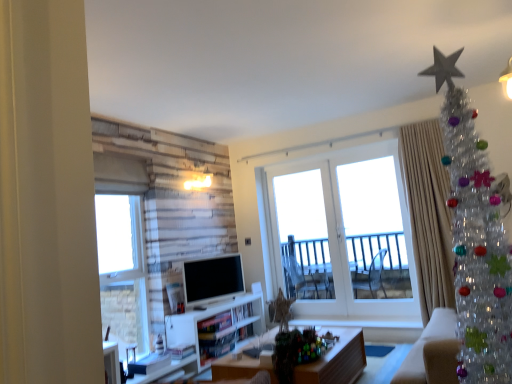
Find the location of a particular element. white glossy television at center is located at coordinates click(x=212, y=279).

Image resolution: width=512 pixels, height=384 pixels. What do you see at coordinates (122, 249) in the screenshot?
I see `clear glass window at left, which is counted as the 2th window, starting from the right` at bounding box center [122, 249].

Where is `clear glass window at left, the 1th window from the left`? clear glass window at left, the 1th window from the left is located at coordinates (122, 249).

Describe the element at coordinates (428, 213) in the screenshot. The width and height of the screenshot is (512, 384). I see `silky beige curtain at right` at that location.

In order to face wooden desk at center, should I rotate leftwards or rightwards?

Rotate your view right by about 5.305°.

This screenshot has height=384, width=512. What do you see at coordinates (475, 240) in the screenshot? I see `clear plastic christmas tree at upper right` at bounding box center [475, 240].

Image resolution: width=512 pixels, height=384 pixels. What are the coordinates of `white glass door at center, which is the 2th window in front-to-back order` in the screenshot? It's located at (333, 229).

Is point (301, 380) positioned after point (209, 259)?

No, (301, 380) is in front of (209, 259).

From a real-world perspective, who is located higher, wooden desk at center or white glossy television at center?

white glossy television at center.

Is wooden desk at center far from white glossy television at center?

Yes, wooden desk at center and white glossy television at center are quite far apart.

Looking at this image, is wooden desk at center aimed at white glossy television at center?

No, wooden desk at center does not turn towards white glossy television at center.

Does white glossy television at center turn towards white glass door at center, the second window when ordered from left to right?

No, white glossy television at center is not aimed at white glass door at center, the second window when ordered from left to right.

Which is more to the right, white glossy television at center or white glass door at center, which appears as the first window when viewed from the right?

Positioned to the right is white glass door at center, which appears as the first window when viewed from the right.

From a real-world perspective, is white glossy television at center on top of white glass door at center, which appears as the first window when viewed from the right?

No, from a real-world perspective, white glossy television at center is not on top of white glass door at center, which appears as the first window when viewed from the right.

Does white glossy television at center have a lesser height compared to white glass door at center, which appears as the first window when viewed from the right?

Yes, white glossy television at center is shorter than white glass door at center, which appears as the first window when viewed from the right.

Considering the points (406, 309) and (290, 259), which point is in front, point (406, 309) or point (290, 259)?

The point (406, 309) is in front.

Can you confirm if white glass door at center, which is the 2th window in front-to-back order, is shorter than white glossy door at center?

In fact, white glass door at center, which is the 2th window in front-to-back order, may be taller than white glossy door at center.

Considering the relative positions of white glass door at center, the first window in the back-to-front sequence, and white glossy door at center in the image provided, is white glass door at center, the first window in the back-to-front sequence, to the left of white glossy door at center from the viewer's perspective?

No, white glass door at center, the first window in the back-to-front sequence, is not to the left of white glossy door at center.

Consider the image. Considering the sizes of white glass door at center, which is the 2th window in front-to-back order, and white glossy door at center in the image, is white glass door at center, which is the 2th window in front-to-back order, bigger or smaller than white glossy door at center?

white glass door at center, which is the 2th window in front-to-back order, is bigger than white glossy door at center.

Is clear plastic christmas tree at upper right not near silky beige curtain at right?

Indeed, clear plastic christmas tree at upper right is not near silky beige curtain at right.

Consider the image. Considering the relative positions of clear plastic christmas tree at upper right and silky beige curtain at right in the image provided, is clear plastic christmas tree at upper right to the left or to the right of silky beige curtain at right?

clear plastic christmas tree at upper right is positioned on silky beige curtain at right's left side.

Considering the positions of objects clear plastic christmas tree at upper right and silky beige curtain at right in the image provided, who is behind, clear plastic christmas tree at upper right or silky beige curtain at right?

silky beige curtain at right is further away from the camera.

The width and height of the screenshot is (512, 384). I want to click on curtain located below the clear plastic christmas tree at upper right (from the image's perspective), so click(x=428, y=213).

Considering the positions of point (295, 187) and point (267, 340), is point (295, 187) closer or farther from the camera than point (267, 340)?

Point (295, 187).

Is white glossy door at center closer to camera compared to wooden desk at center?

No, white glossy door at center is further to the viewer.

Is there a large distance between white glossy door at center and wooden desk at center?

Indeed, white glossy door at center is not near wooden desk at center.

Locate an element on the screen. desk directly beneath the white glossy door at center (from a real-world perspective) is located at coordinates (336, 360).

From a real-world perspective, does white glossy television at center sit lower than silky beige curtain at right?

Yes, from a real-world perspective, white glossy television at center is under silky beige curtain at right.

Is white glossy television at center inside the boundaries of silky beige curtain at right, or outside?

white glossy television at center cannot be found inside silky beige curtain at right.

Consider the image. Is white glossy television at center positioned far away from silky beige curtain at right?

Yes, white glossy television at center and silky beige curtain at right are located far from each other.

Consider the image. Which is more distant, (228,273) or (426,206)?

The point (228,273) is farther from the camera.

From the picture: Which object is positioned more to the right, clear glass window at left, the second window viewed from the back, or wooden desk at center?

wooden desk at center.

Can we say clear glass window at left, the 1th window from the left, lies outside wooden desk at center?

Yes, clear glass window at left, the 1th window from the left, is located beyond the bounds of wooden desk at center.

Who is smaller, clear glass window at left, the second window viewed from the back, or wooden desk at center?

clear glass window at left, the second window viewed from the back.

Is clear glass window at left, the 1th window from the left, oriented towards wooden desk at center?

Yes, clear glass window at left, the 1th window from the left, is facing wooden desk at center.

Where is `desk that is below the white glossy television at center (from the image's perspective)`? desk that is below the white glossy television at center (from the image's perspective) is located at coordinates (336, 360).

You are a GUI agent. You are given a task and a screenshot of the screen. Output one action in this format:
    pyautogui.click(x=<x>, y=<y>)
    Task: Click on the television that appears below the white glass door at center, the second window when ordered from left to right (from a real-world perspective)
    Image resolution: width=512 pixels, height=384 pixels.
    Given the screenshot: What is the action you would take?
    pyautogui.click(x=212, y=279)

From the image, which object appears to be farther from wooden desk at center, white glossy door at center or clear glass window at left, the second window viewed from the back?

clear glass window at left, the second window viewed from the back, is positioned further to the anchor wooden desk at center.

In the scene shown: From the image, which object appears to be farther from clear plastic christmas tree at upper right, white glossy television at center or clear glass window at left, the second window viewed from the back?

clear glass window at left, the second window viewed from the back, lies further to clear plastic christmas tree at upper right than the other object.

Based on the photo, looking at the image, which one is located further to silky beige curtain at right, wooden desk at center or clear glass window at left, the second window viewed from the back?

clear glass window at left, the second window viewed from the back, is further to silky beige curtain at right.

Based on their spatial positions, is silky beige curtain at right or white glass door at center, the second window when ordered from left to right, further from white glossy television at center?

silky beige curtain at right lies further to white glossy television at center than the other object.

Looking at the image, which one is located further to white glossy television at center, white glossy door at center or clear plastic christmas tree at upper right?

clear plastic christmas tree at upper right lies further to white glossy television at center than the other object.

When comparing their distances from clear plastic christmas tree at upper right, does wooden desk at center or white glossy door at center seem further?

The object further to clear plastic christmas tree at upper right is white glossy door at center.

Based on their spatial positions, is clear glass window at left, which is counted as the 2th window, starting from the right, or wooden desk at center closer to silky beige curtain at right?

wooden desk at center lies closer to silky beige curtain at right than the other object.

Based on the photo, which object lies nearer to the anchor point wooden desk at center, clear glass window at left, the 1th window from the left, or silky beige curtain at right?

silky beige curtain at right lies closer to wooden desk at center than the other object.

Find the location of `window between white glossy television at center and silky beige curtain at right in the horizontal direction`. window between white glossy television at center and silky beige curtain at right in the horizontal direction is located at coordinates (333, 229).

Where is `curtain between wooden desk at center and white glossy door at center along the z-axis`? The width and height of the screenshot is (512, 384). curtain between wooden desk at center and white glossy door at center along the z-axis is located at coordinates (428, 213).

The height and width of the screenshot is (384, 512). What are the coordinates of `television between wooden desk at center and white glass door at center, which appears as the first window when viewed from the right, from front to back` in the screenshot? It's located at (212, 279).

At what (x,y) coordinates should I click in order to perform the action: click on curtain between clear plastic christmas tree at upper right and white glossy television at center along the z-axis. Please return your answer as a coordinate pair (x, y). The image size is (512, 384). Looking at the image, I should click on (428, 213).